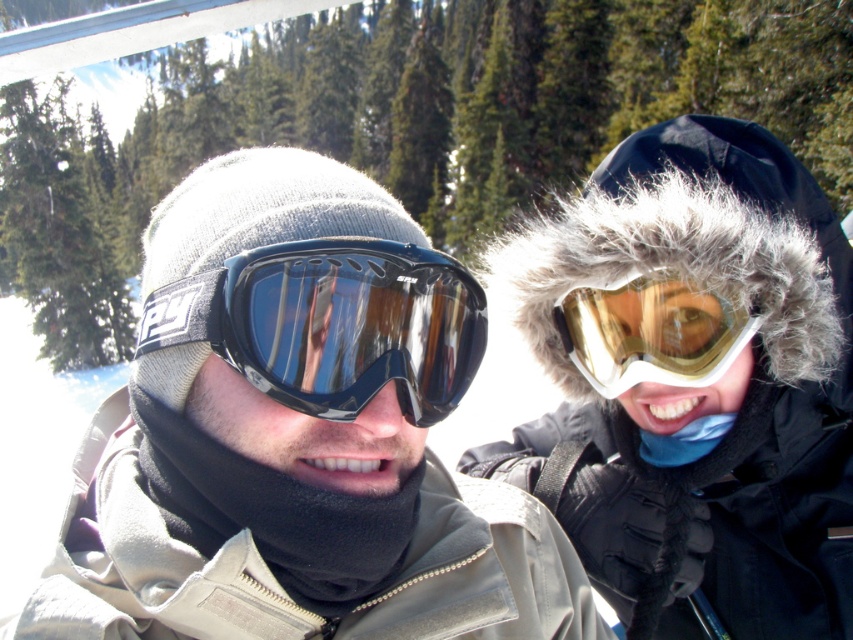
Question: Based on their relative distances, which object is farther from the black glossy goggles at center?

Choices:
 (A) gold reflective goggles at upper right
 (B) matte black goggles at center

Answer: (A)

Question: Can you confirm if black glossy goggles at center is positioned to the right of gold reflective goggles at upper right?

Choices:
 (A) no
 (B) yes

Answer: (A)

Question: Can you confirm if matte black goggles at center is positioned to the right of black glossy goggles at center?

Choices:
 (A) no
 (B) yes

Answer: (A)

Question: Does matte black goggles at center appear over gold reflective goggles at upper right?

Choices:
 (A) yes
 (B) no

Answer: (B)

Question: Which point appears closest to the camera in this image?

Choices:
 (A) (695, 372)
 (B) (424, 528)
 (C) (323, 401)

Answer: (C)

Question: Which of the following is the closest to the observer?

Choices:
 (A) (262, 257)
 (B) (386, 483)

Answer: (A)